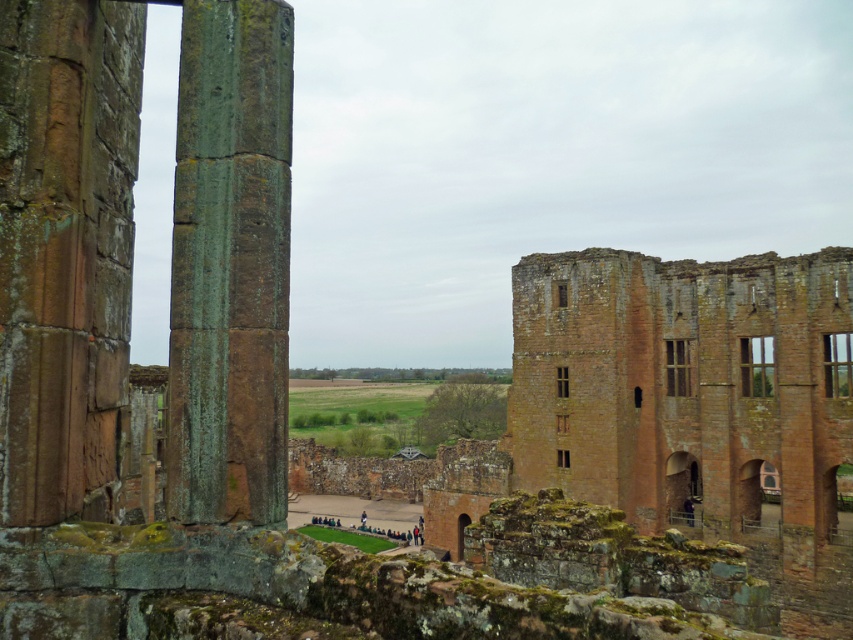
Question: Can you confirm if brown stone window at center is positioned to the right of dark blue fabric at lower right?

Choices:
 (A) no
 (B) yes

Answer: (A)

Question: Observing the image, what is the correct spatial positioning of green mossy stone pillar at center in reference to brown stone window at center-right?

Choices:
 (A) above
 (B) below

Answer: (A)

Question: Can you confirm if matte brown wooden window at upper right is positioned below dark blue fabric at center?

Choices:
 (A) yes
 (B) no

Answer: (B)

Question: Which object is positioned farthest from the dark blue fabric at lower right?

Choices:
 (A) green mossy stone pillar at center
 (B) brown stone window at upper center

Answer: (A)

Question: Which point is closer to the camera?

Choices:
 (A) dark blue fabric at lower right
 (B) brown stone window at upper center

Answer: (A)

Question: Which of the following is the farthest from the observer?

Choices:
 (A) matte brown wooden window at upper right
 (B) wooden window at right
 (C) brown wooden window at center-right
 (D) green mossy stone pillar at center

Answer: (C)